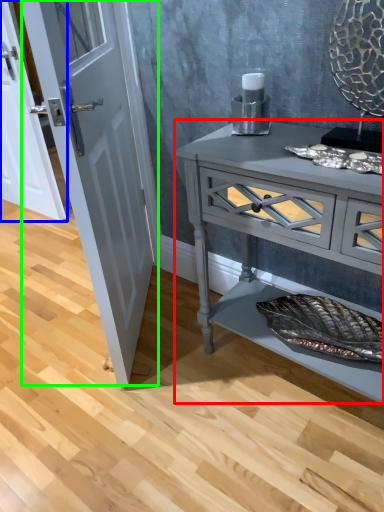
Question: Which object is the farthest from chest of drawers (highlighted by a red box)? Choose among these: door (highlighted by a blue box) or door (highlighted by a green box).

Choices:
 (A) door
 (B) door

Answer: (A)